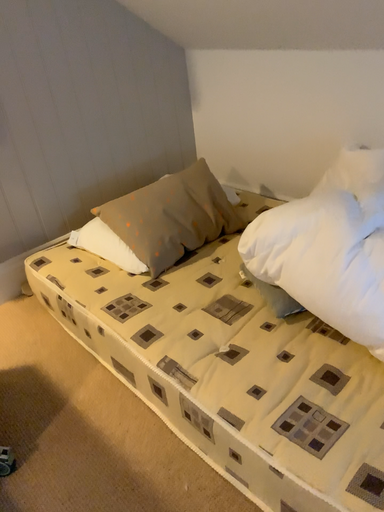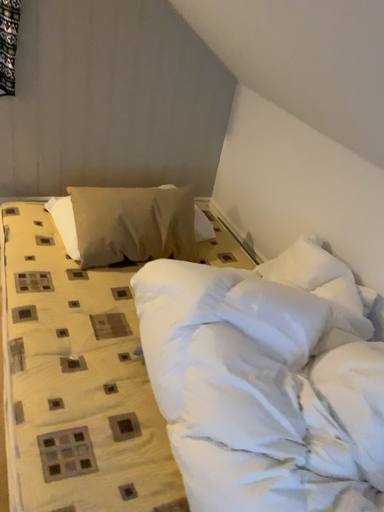
Question: Which way did the camera rotate in the video?

Choices:
 (A) rotated left
 (B) rotated right

Answer: (A)